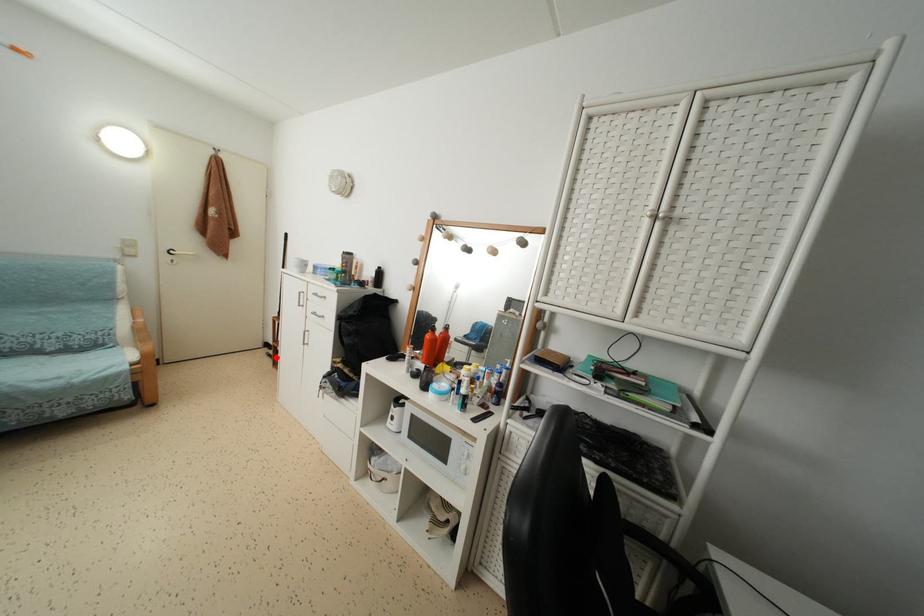
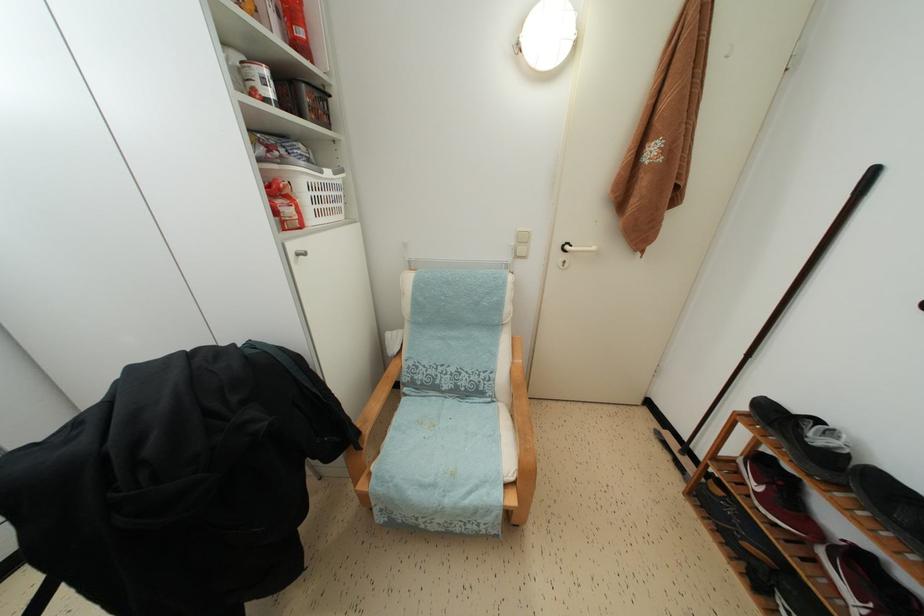
Question: I am providing you with two images of the same scene from different viewpoints. In image1, a red point is highlighted. Considering the same 3D point in image2, which of the following is correct?

Choices:
 (A) It is closer
 (B) It is farther

Answer: (A)